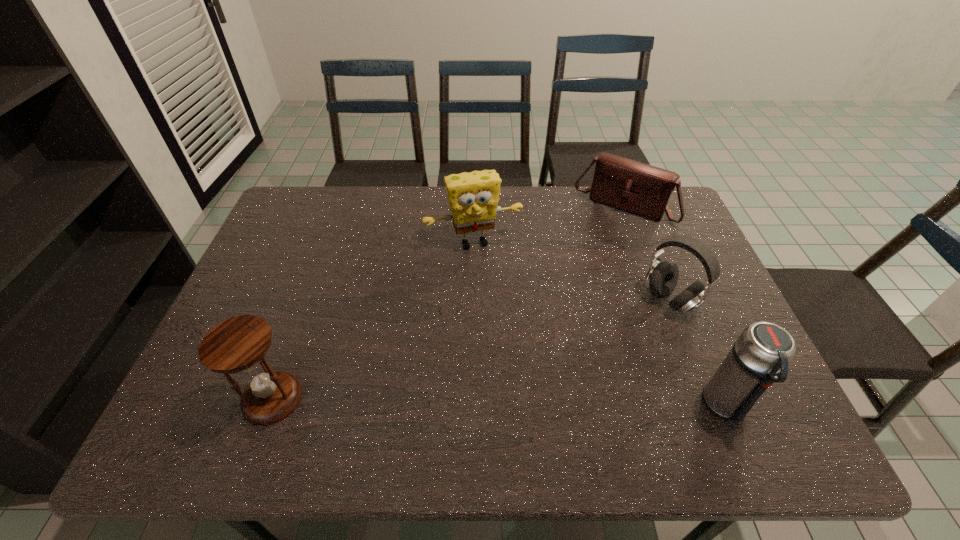
This screenshot has width=960, height=540. I want to click on vacant space situated 0.300m on the front flap of the shoulder bag, so click(569, 286).

Where is `free point located on the front flap of the shoulder bag`? free point located on the front flap of the shoulder bag is located at coordinates (586, 260).

The image size is (960, 540). What are the coordinates of `free space located on the face of the second object from left to right` in the screenshot? It's located at (503, 301).

Locate an element on the screen. free spot located 0.190m on the face of the second object from left to right is located at coordinates (503, 301).

In order to click on free space located on the face of the second object from left to right in this screenshot , I will do `click(517, 340)`.

Where is `shoulder bag that is positioned at the far edge`? This screenshot has height=540, width=960. shoulder bag that is positioned at the far edge is located at coordinates (637, 188).

Find the location of `sponge that is at the far edge`. sponge that is at the far edge is located at coordinates [473, 197].

You are a GUI agent. You are given a task and a screenshot of the screen. Output one action in this format:
    pyautogui.click(x=<x>, y=<y>)
    Task: Click on the hourglass at the near edge
    This screenshot has width=960, height=540.
    Given the screenshot: What is the action you would take?
    pyautogui.click(x=238, y=344)

Where is `thermos bottle positioned at the near edge`? Image resolution: width=960 pixels, height=540 pixels. thermos bottle positioned at the near edge is located at coordinates [760, 356].

The image size is (960, 540). Find the location of `object present at the left edge`. object present at the left edge is located at coordinates (238, 344).